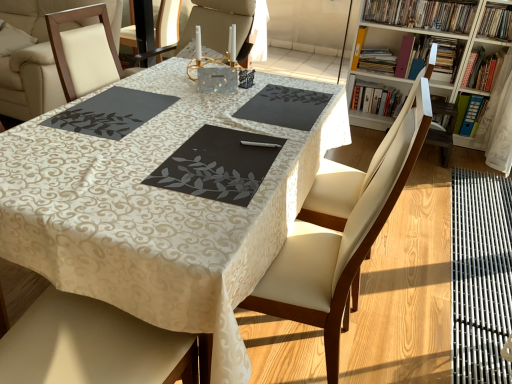
Question: Considering the positions of point (465, 119) and point (354, 48), is point (465, 119) closer or farther from the camera than point (354, 48)?

Choices:
 (A) closer
 (B) farther

Answer: (A)

Question: From the image's perspective, is blue plastic folder at upper right, marked as the 3th book in a right-to-left arrangement, above or below yellow paper at upper right, placed as the 9th book when sorted from right to left?

Choices:
 (A) below
 (B) above

Answer: (A)

Question: Which object is positioned closest to the hardcover books at upper right, the fifth book from the right?

Choices:
 (A) wooden bookcase at upper right
 (B) hardcover book at upper right, placed as the 9th book when sorted from left to right
 (C) hardcover book at upper right, the sixth book when ordered from left to right
 (D) yellow paper at upper right, which is the 1th book from left to right
 (E) leather seat at center

Answer: (C)

Question: Which object is positioned farthest from the black matte placemat at center, the 1th place mat when ordered from right to left?

Choices:
 (A) wooden bookcase at upper right
 (B) hardcover books at upper right, the 7th book from the right
 (C) hardcover book at upper right, which is the eighth book in right-to-left order
 (D) hardcover book at upper right, the sixth book when ordered from left to right
 (E) black matte place mat at center, which appears as the second place mat when viewed from the right

Answer: (B)